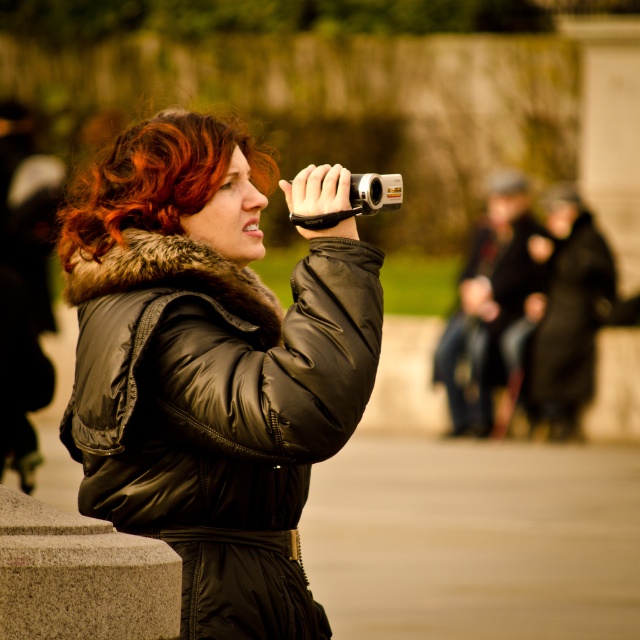
What object is located at the coordinates point [211,365] in the image?

The point [211,365] corresponds to the black leather jacket at center.

Based on the scene description, which object at center has a greater width? The curly auburn hair at center or the dark gray fabric jacket at center?

The curly auburn hair at center might be wider than dark gray fabric jacket at center according to the description.

You are a photographer trying to set up your equipment. You have a dark gray fabric jacket at center and a silver metallic camera at upper center in your view. Which object is positioned higher in the frame?

The silver metallic camera at upper center is positioned higher in the frame than the dark gray fabric jacket at center.